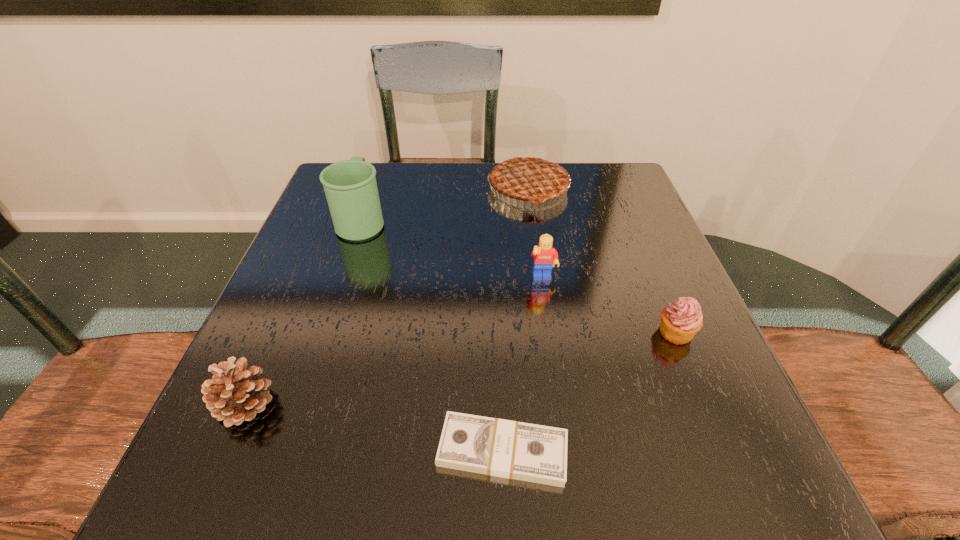
Identify which object is located as the nearest to the shortest object. Please provide its 2D coordinates. Your answer should be formatted as a tuple, i.e. [(x, y)], where the tuple contains the x and y coordinates of a point satisfying the conditions above.

[(681, 320)]

You are a GUI agent. You are given a task and a screenshot of the screen. Output one action in this format:
    pyautogui.click(x=<x>, y=<y>)
    Task: Click on the second closest object relative to the pinecone
    This screenshot has width=960, height=540.
    Given the screenshot: What is the action you would take?
    pyautogui.click(x=350, y=186)

In order to click on free location that satisfies the following two spatial constraints: 1. on the front side of the pie; 2. on the right side of the rightmost object in this screenshot , I will do `click(550, 332)`.

Find the location of a particular element. The image size is (960, 540). free location that satisfies the following two spatial constraints: 1. on the side of the mug with the handle; 2. on the right side of the pie is located at coordinates (372, 189).

Locate an element on the screen. Image resolution: width=960 pixels, height=540 pixels. free location that satisfies the following two spatial constraints: 1. on the face of the rightmost object; 2. on the left side of the fourth nearest object is located at coordinates (551, 332).